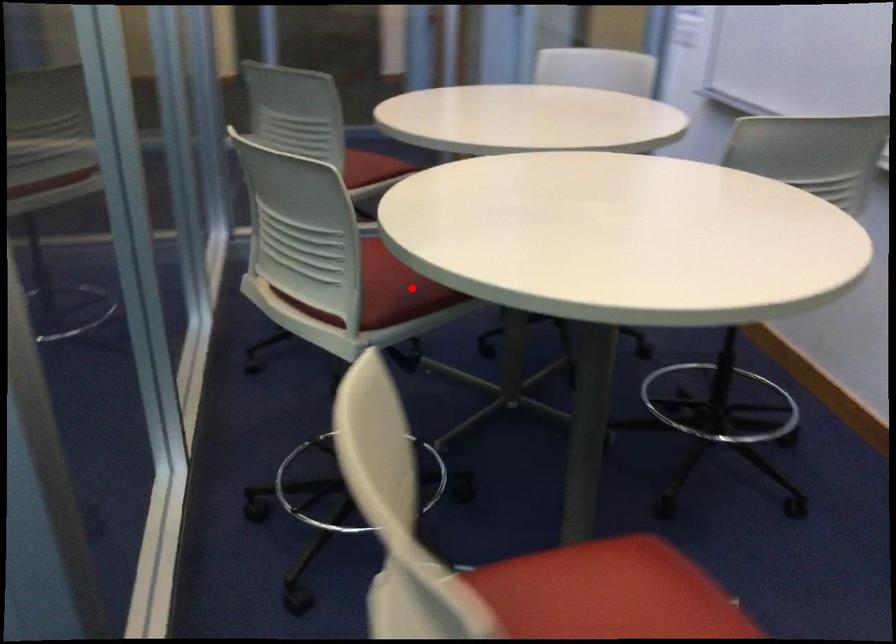
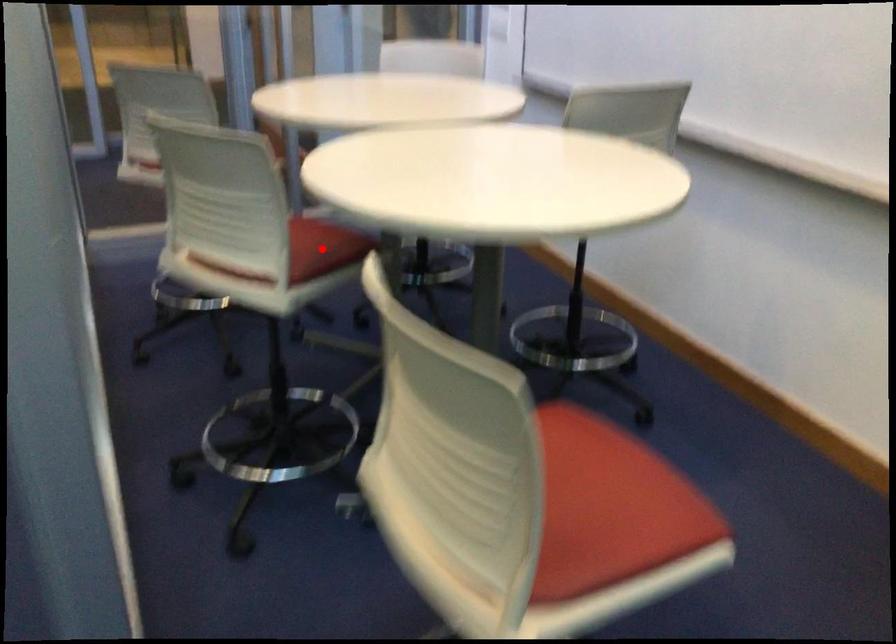
I am providing you with two images of the same scene from different viewpoints. A red point is marked on the first image and another point is marked on the second image. Is the red point in image1 aligned with the point shown in image2?

Yes